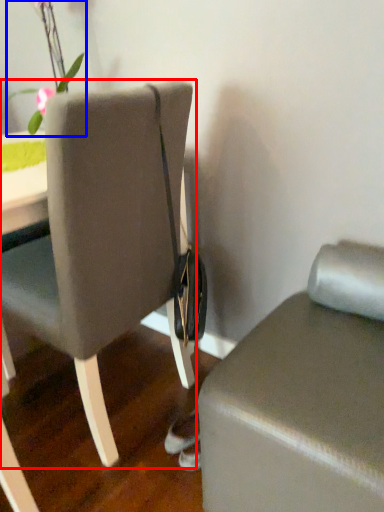
Question: Which object is further to the camera taking this photo, chair (highlighted by a red box) or floral arrangement (highlighted by a blue box)?

Choices:
 (A) chair
 (B) floral arrangement

Answer: (B)